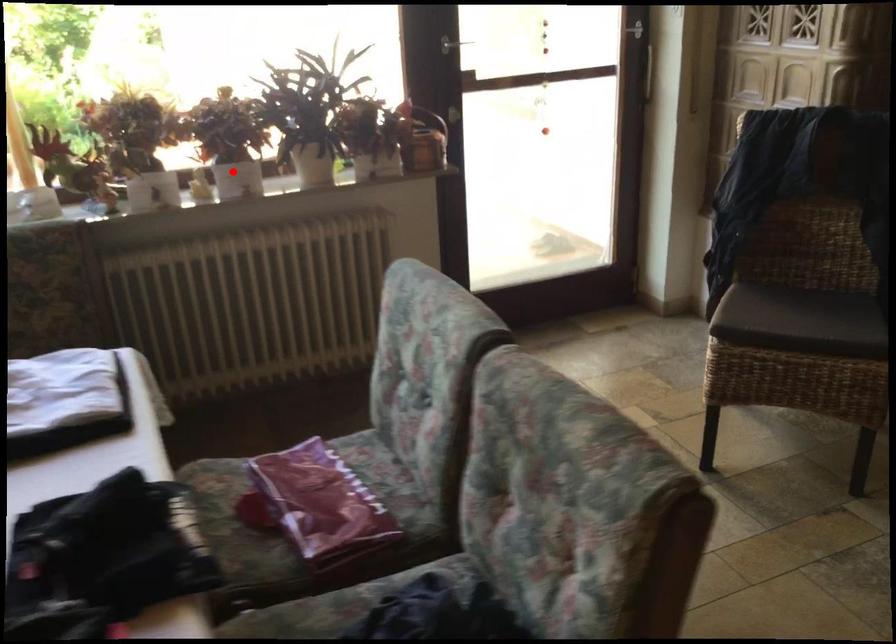
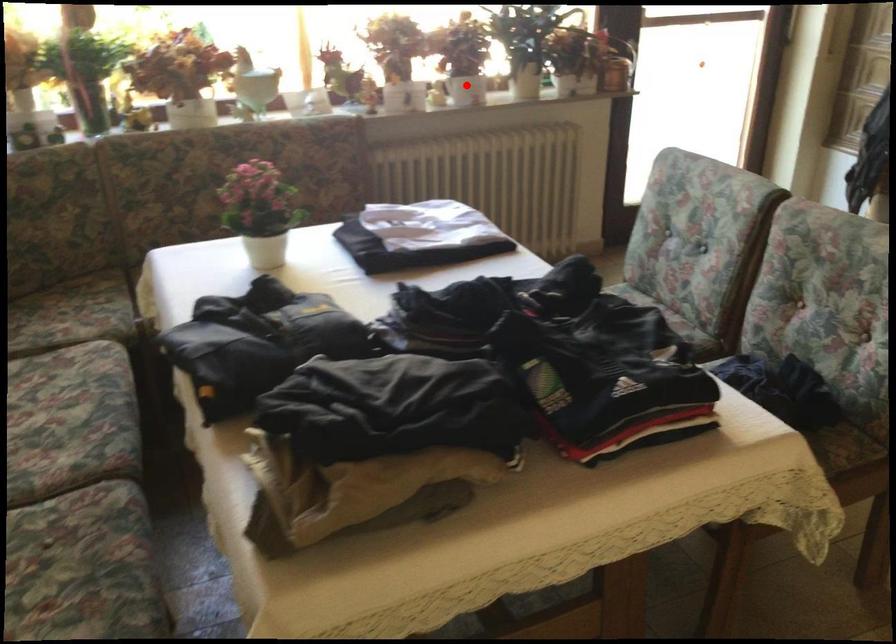
Based on the photo, I am providing you with two images of the same scene from different viewpoints. A red point is marked on the first image and another point is marked on the second image. Are the points marked in image1 and image2 representing the same 3D position?

Yes